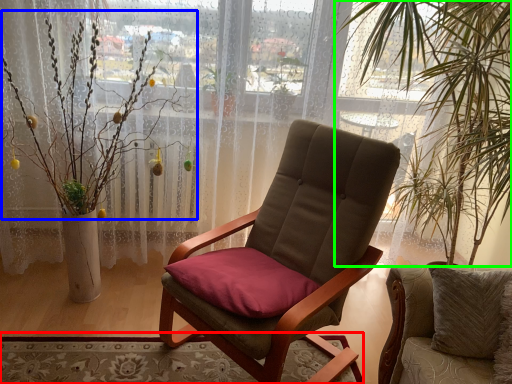
Question: Based on their relative distances, which object is nearer to mat (highlighted by a red box)? Choose from floral arrangement (highlighted by a blue box) and vegetation (highlighted by a green box).

Choices:
 (A) floral arrangement
 (B) vegetation

Answer: (A)